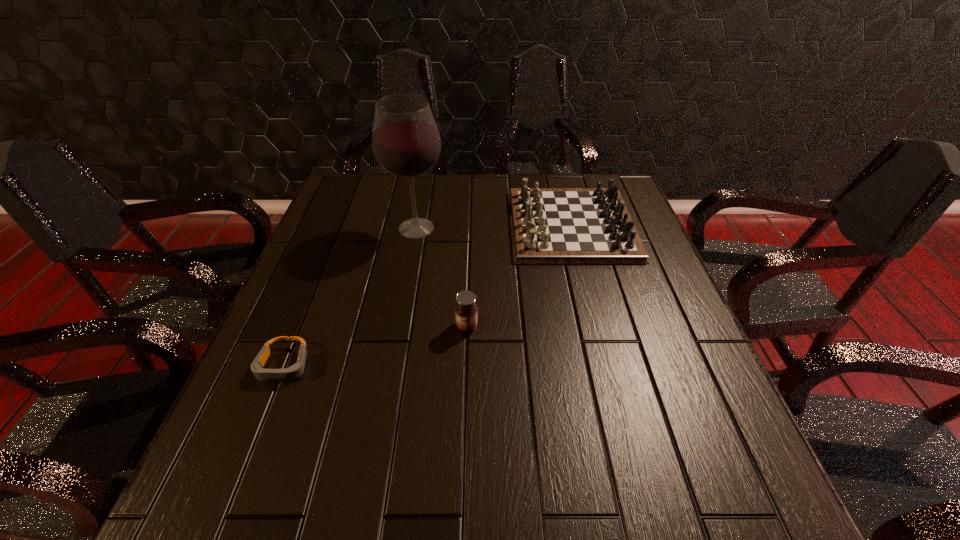
The width and height of the screenshot is (960, 540). I want to click on the third object from right to left, so click(x=406, y=143).

At what (x,y) coordinates should I click in order to perform the action: click on alcohol. Please return your answer as a coordinate pair (x, y). Looking at the image, I should click on [x=406, y=143].

This screenshot has height=540, width=960. I want to click on the second nearest object, so click(x=466, y=313).

Find the location of `jam`. jam is located at coordinates (466, 313).

You are a GUI agent. You are given a task and a screenshot of the screen. Output one action in this format:
    pyautogui.click(x=<x>, y=<y>)
    Task: Click on the chessboard
    The image size is (960, 540).
    Given the screenshot: What is the action you would take?
    pyautogui.click(x=548, y=225)

The width and height of the screenshot is (960, 540). I want to click on the shortest object, so click(x=294, y=372).

Locate an element on the screen. This screenshot has width=960, height=540. the leftmost object is located at coordinates click(294, 372).

Where is `vacant space located on the right of the third object from right to left`? This screenshot has width=960, height=540. vacant space located on the right of the third object from right to left is located at coordinates (544, 228).

Where is `free space located 0.340m on the label side of the second nearest object`? free space located 0.340m on the label side of the second nearest object is located at coordinates (462, 494).

Identify the location of vacant position located 0.170m from the player's perspective of the chessboard. The image size is (960, 540). (452, 225).